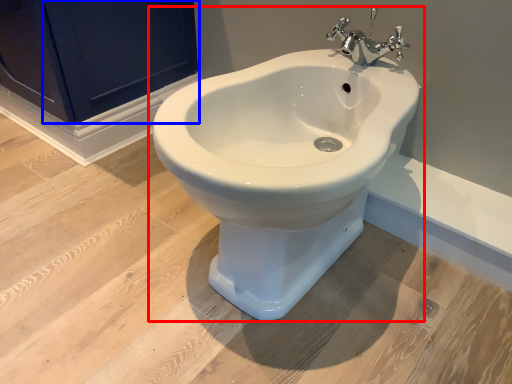
Question: Among these objects, which one is nearest to the camera, toilet (highlighted by a red box) or screen door (highlighted by a blue box)?

Choices:
 (A) toilet
 (B) screen door

Answer: (A)